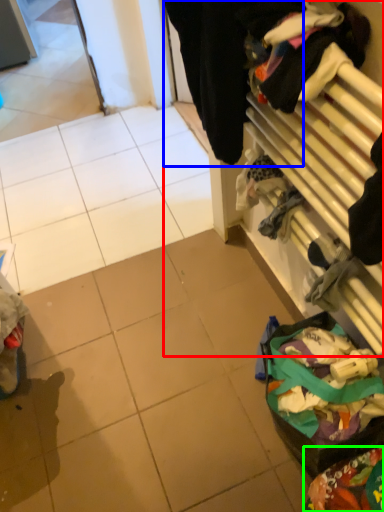
Question: Which object is the farthest from closet (highlighted by a red box)? Choose among these: clothing (highlighted by a blue box) or waste (highlighted by a green box).

Choices:
 (A) clothing
 (B) waste

Answer: (B)